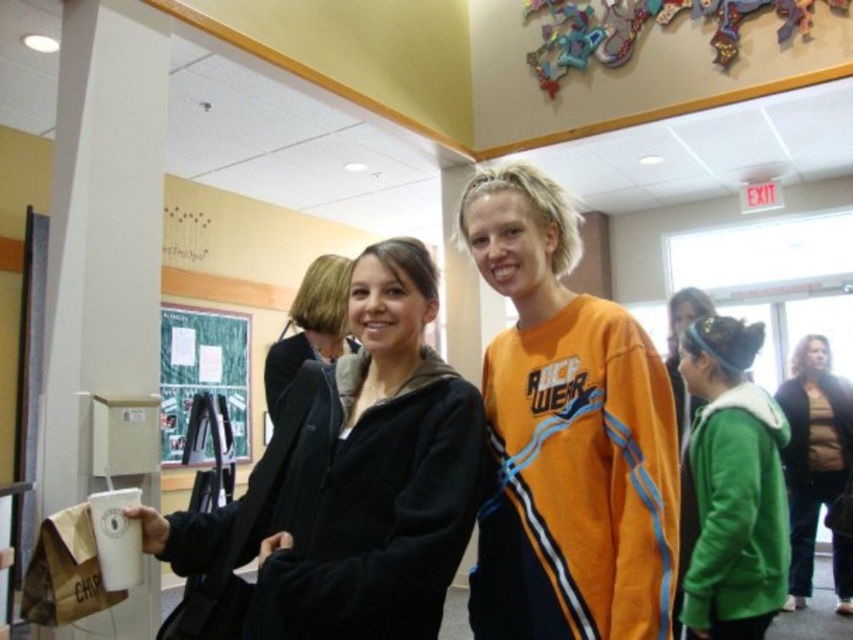
You are standing in the hallway and want to hand a flyer to the person wearing the green fuzzy jacket at right. To reach them, you need to walk past the green matte bulletin board at center. Based on their positions, will you pass the bulletin board before reaching the jacket?

Yes, since the green fuzzy jacket at right is on the right side of the green matte bulletin board at center, you would first pass the bulletin board and then reach the jacket.

You are standing in the hallway and need to place a large poster on the wall. The poster is too big to hold with one hand. Which object, the white matte pillar at left or the matte black jacket at center, would be more suitable to temporarily lean the poster against while you secure it?

The white matte pillar at left is larger in size than the matte black jacket at center, so it would provide a more stable and suitable surface to lean the poster against temporarily.

You are an interior designer assessing the hallway layout. The white matte pillar at left and the matte black jacket at center are both in your line of sight. Which object occupies more horizontal space in the scene?

The white matte pillar at left has a larger width than the matte black jacket at center, so it occupies more horizontal space in the scene.